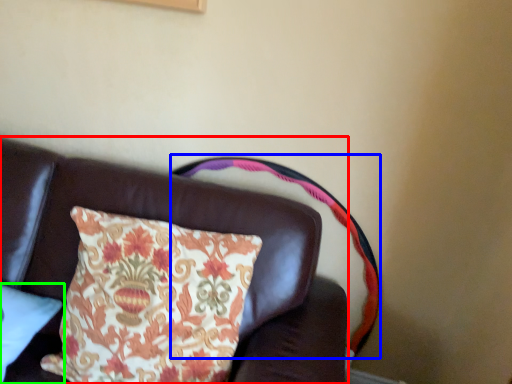
Question: Which object is the closest to the furniture (highlighted by a red box)? Choose among these: swivel chair (highlighted by a blue box) or pillow (highlighted by a green box).

Choices:
 (A) swivel chair
 (B) pillow

Answer: (A)